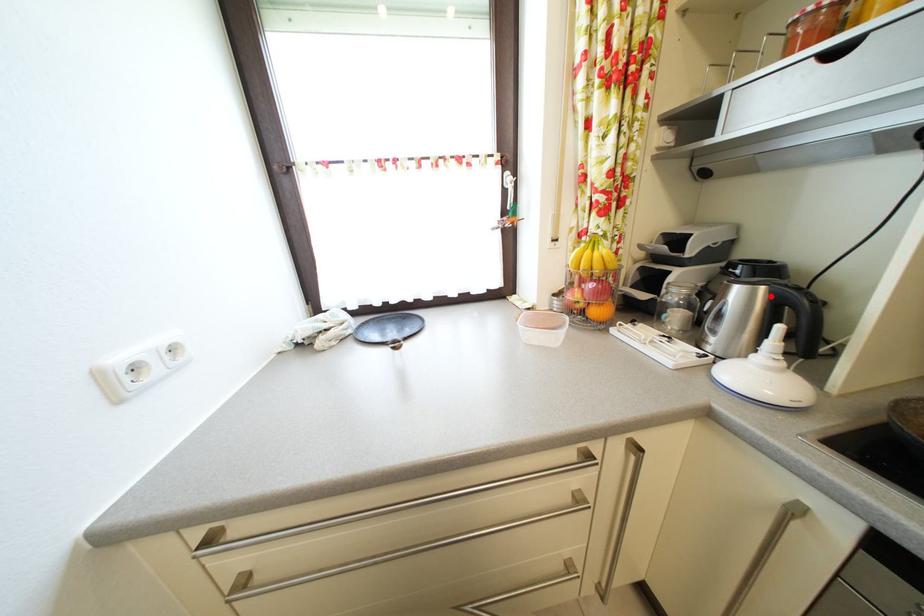
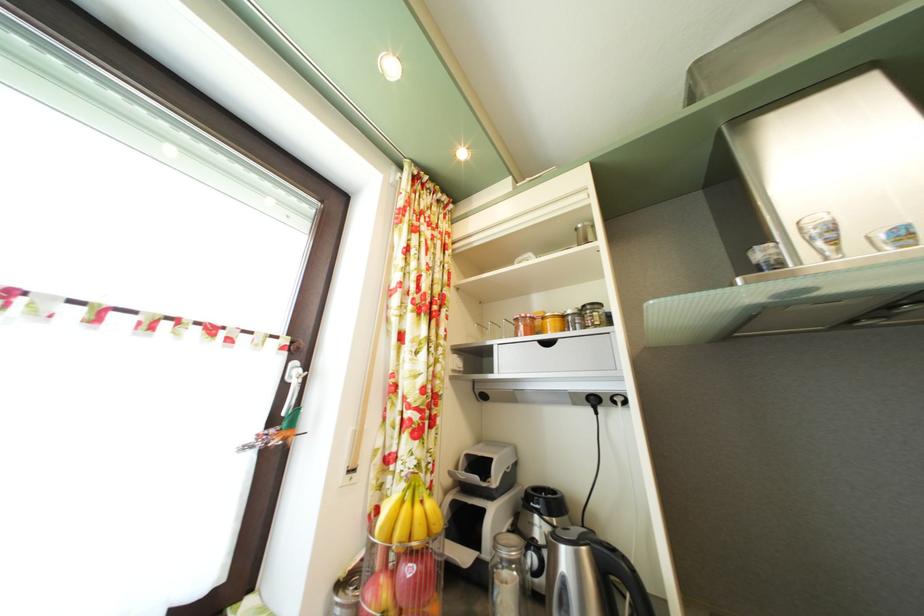
Find the pixel in the second image that matches the highlighted location in the first image.

(592, 556)